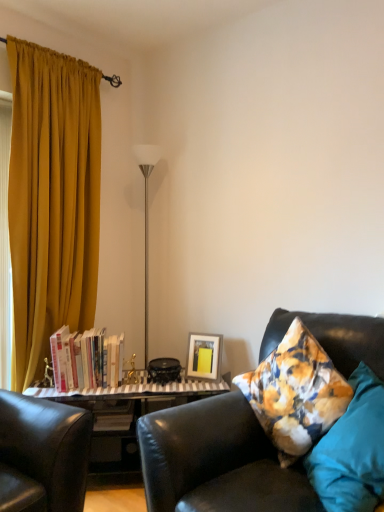
Where is `hardcover books at left`? The width and height of the screenshot is (384, 512). hardcover books at left is located at coordinates (85, 359).

The height and width of the screenshot is (512, 384). What do you see at coordinates (217, 461) in the screenshot?
I see `leather couch at right` at bounding box center [217, 461].

What are the coordinates of `silver/metallic floor lamp at center` in the screenshot? It's located at (146, 217).

The image size is (384, 512). What do you see at coordinates (52, 200) in the screenshot? I see `mustard fabric curtain at left` at bounding box center [52, 200].

This screenshot has width=384, height=512. Find the location of `teal fabric pillow at right`. teal fabric pillow at right is located at coordinates (352, 450).

Identify the location of hardcover books at left. (85, 359).

Does hardcover books at left have a smaller size compared to mustard fabric curtain at left?

Yes.

Which of these two, hardcover books at left or mustard fabric curtain at left, stands shorter?

hardcover books at left is shorter.

I want to click on book to the right of mustard fabric curtain at left, so click(x=85, y=359).

Is hardcover books at left not within leather couch at right?

hardcover books at left is positioned outside leather couch at right.

How different are the orientations of hardcover books at left and leather couch at right in degrees?

hardcover books at left and leather couch at right are facing 47.7 degrees away from each other.

Measure the distance between hardcover books at left and leather couch at right.

hardcover books at left is 35.58 inches away from leather couch at right.

Based on the photo, which is more to the right, hardcover books at left or leather couch at right?

leather couch at right is more to the right.

Is the depth of matte yellow picture frame at center greater than that of teal fabric pillow at right?

Yes.

Identify the location of pillow in front of the matte yellow picture frame at center. (352, 450).

Would you say matte yellow picture frame at center is to the left or to the right of teal fabric pillow at right in the picture?

In the image, matte yellow picture frame at center appears on the left side of teal fabric pillow at right.

Is matte yellow picture frame at center placed right next to teal fabric pillow at right?

No, matte yellow picture frame at center is not next to teal fabric pillow at right.

Is hardcover books at left turned away from teal fabric pillow at right?

hardcover books at left does not have its back to teal fabric pillow at right.

Considering the positions of objects hardcover books at left and teal fabric pillow at right in the image provided, who is in front, hardcover books at left or teal fabric pillow at right?

teal fabric pillow at right is more forward.

Considering the positions of point (103, 367) and point (359, 480), is point (103, 367) closer or farther from the camera than point (359, 480)?

Point (103, 367) is positioned farther from the camera compared to point (359, 480).

From their relative heights in the image, would you say hardcover books at left is taller or shorter than teal fabric pillow at right?

In the image, hardcover books at left appears to be shorter than teal fabric pillow at right.

Is silver/metallic floor lamp at center wider than mustard fabric curtain at left?

No, silver/metallic floor lamp at center is not wider than mustard fabric curtain at left.

Are silver/metallic floor lamp at center and mustard fabric curtain at left making contact?

No, silver/metallic floor lamp at center is not beside mustard fabric curtain at left.

At what (x,y) coordinates should I click in order to perform the action: click on lamp lying below the mustard fabric curtain at left (from the image's perspective). Please return your answer as a coordinate pair (x, y). Looking at the image, I should click on (146, 217).

Which is behind, point (147, 275) or point (53, 197)?

The point (147, 275) is farther.

Does mustard fabric curtain at left have a greater height compared to leather couch at right?

Correct, mustard fabric curtain at left is much taller as leather couch at right.

Find the location of `curtain above the leather couch at right (from a real-world perspective)`. curtain above the leather couch at right (from a real-world perspective) is located at coordinates (52, 200).

From a real-world perspective, who is located higher, mustard fabric curtain at left or leather couch at right?

mustard fabric curtain at left is physically above.

Between matte yellow picture frame at center and silver/metallic floor lamp at center, which one has larger size?

With larger size is silver/metallic floor lamp at center.

Considering the sizes of objects matte yellow picture frame at center and silver/metallic floor lamp at center in the image provided, who is thinner, matte yellow picture frame at center or silver/metallic floor lamp at center?

matte yellow picture frame at center.

At what (x,y) coordinates should I click in order to perform the action: click on picture frame in front of the silver/metallic floor lamp at center. Please return your answer as a coordinate pair (x, y). This screenshot has width=384, height=512. Looking at the image, I should click on [x=204, y=357].

I want to click on book lying behind the mustard fabric curtain at left, so click(85, 359).

The image size is (384, 512). Find the location of `studio couch below the hardcover books at left (from the image's perspective)`. studio couch below the hardcover books at left (from the image's perspective) is located at coordinates (217, 461).

Estimate the real-world distances between objects in this image. Which object is further from leather couch at right, matte yellow picture frame at center or mustard fabric curtain at left?

Among the two, mustard fabric curtain at left is located further to leather couch at right.

Considering their positions, is hardcover books at left positioned further to teal fabric pillow at right than silver/metallic floor lamp at center?

silver/metallic floor lamp at center lies further to teal fabric pillow at right than the other object.

Looking at the image, which one is located closer to hardcover books at left, teal fabric pillow at right or matte yellow picture frame at center?

Among the two, matte yellow picture frame at center is located nearer to hardcover books at left.

Looking at this image, when comparing their distances from teal fabric pillow at right, does matte yellow picture frame at center or leather couch at right seem closer?

Among the two, leather couch at right is located nearer to teal fabric pillow at right.

When comparing their distances from hardcover books at left, does matte yellow picture frame at center or mustard fabric curtain at left seem closer?

matte yellow picture frame at center.

Based on the photo, from the image, which object appears to be farther from teal fabric pillow at right, hardcover books at left or mustard fabric curtain at left?

mustard fabric curtain at left lies further to teal fabric pillow at right than the other object.

Estimate the real-world distances between objects in this image. Which object is closer to mustard fabric curtain at left, hardcover books at left or leather couch at right?

hardcover books at left is positioned closer to the anchor mustard fabric curtain at left.

From the image, which object appears to be farther from hardcover books at left, mustard fabric curtain at left or silver/metallic floor lamp at center?

silver/metallic floor lamp at center.

This screenshot has height=512, width=384. I want to click on book located between mustard fabric curtain at left and matte yellow picture frame at center in the left-right direction, so click(x=85, y=359).

The height and width of the screenshot is (512, 384). Find the location of `book between leather couch at right and silver/metallic floor lamp at center from front to back`. book between leather couch at right and silver/metallic floor lamp at center from front to back is located at coordinates (85, 359).

Find the location of a particular element. This screenshot has height=512, width=384. curtain positioned between leather couch at right and silver/metallic floor lamp at center from near to far is located at coordinates (52, 200).

Locate an element on the screen. This screenshot has height=512, width=384. lamp situated between mustard fabric curtain at left and teal fabric pillow at right from left to right is located at coordinates (146, 217).